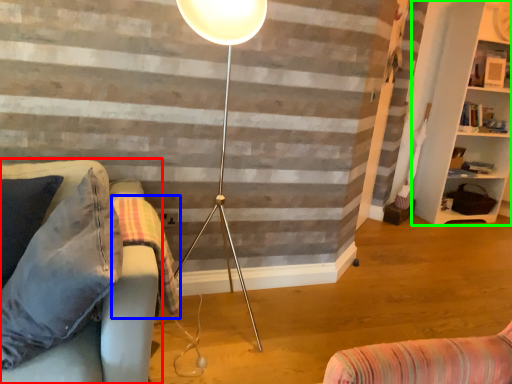
Question: Estimate the real-world distances between objects in this image. Which object is farther from studio couch (highlighted by a red box), blanket (highlighted by a blue box) or shelf (highlighted by a green box)?

Choices:
 (A) blanket
 (B) shelf

Answer: (B)